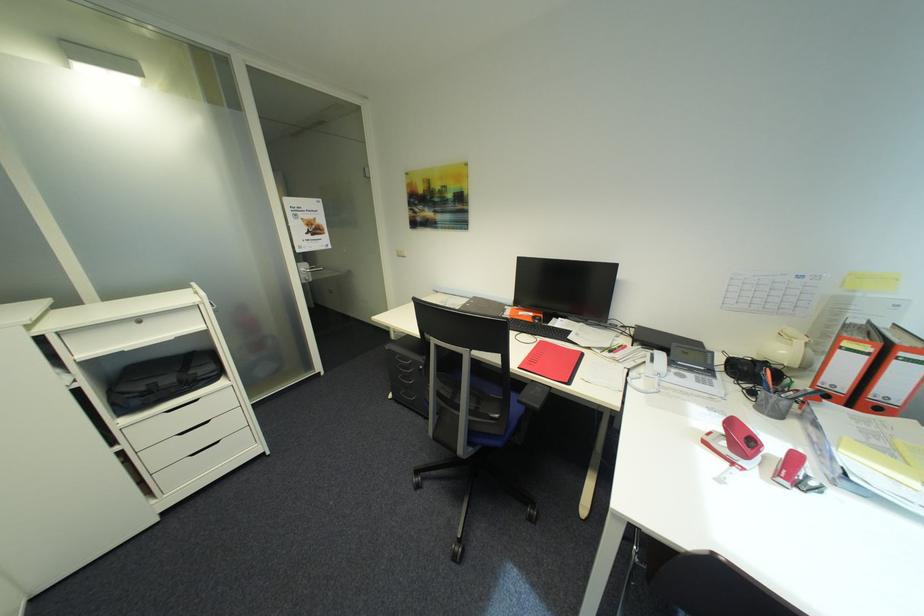
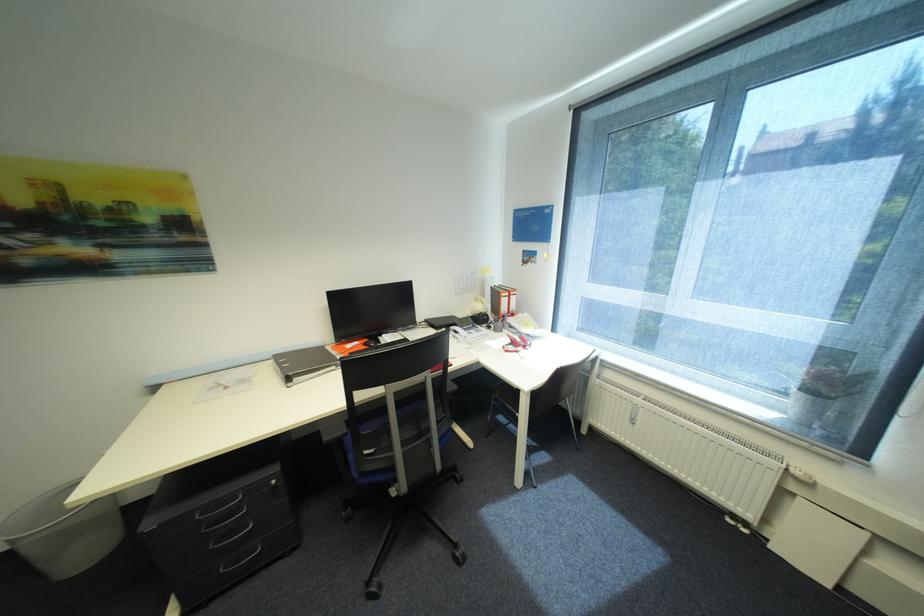
Locate, in the second image, the point that corresponds to (x=760, y=392) in the first image.

(496, 328)